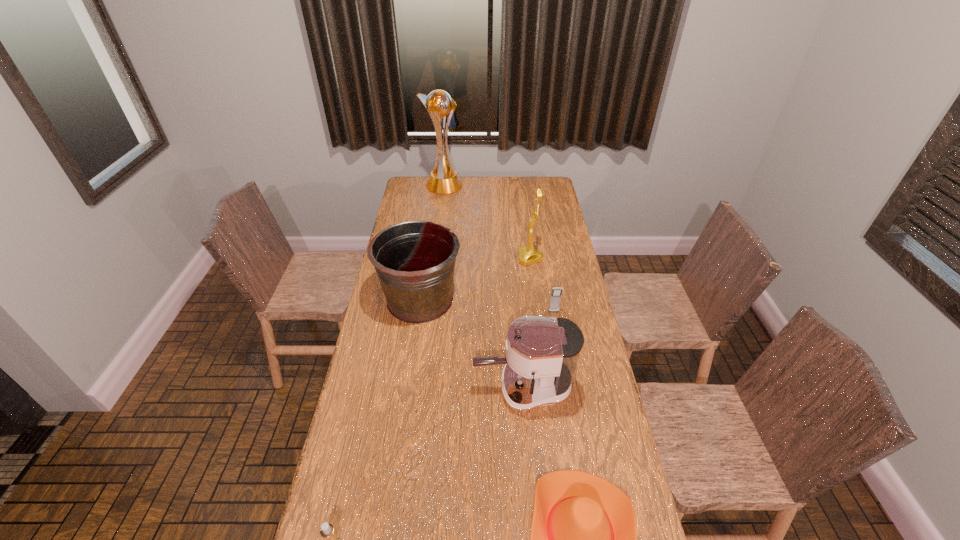
This screenshot has width=960, height=540. What are the coordinates of `cellular telephone present at the right edge` in the screenshot? It's located at (555, 298).

Where is `object present at the far left corner`? object present at the far left corner is located at coordinates (443, 179).

In the image, there is a desktop. Identify the location of vacant space at the far edge. (496, 191).

Where is `vacant space at the left edge of the desktop`? The height and width of the screenshot is (540, 960). vacant space at the left edge of the desktop is located at coordinates (359, 532).

Locate an element on the screen. This screenshot has width=960, height=540. vacant space at the right edge is located at coordinates (600, 406).

Find the location of `vacant space at the far right corner of the desktop`. vacant space at the far right corner of the desktop is located at coordinates (530, 194).

The height and width of the screenshot is (540, 960). In order to click on empty space between the bucket and the coffee maker in this screenshot , I will do `click(471, 344)`.

Locate an element on the screen. The width and height of the screenshot is (960, 540). vacant region between the third nearest object and the bucket is located at coordinates (471, 344).

Where is `vacant space that's between the award and the farthest object`? The image size is (960, 540). vacant space that's between the award and the farthest object is located at coordinates (487, 222).

Identify the location of vacant area between the award and the trophy. (487, 222).